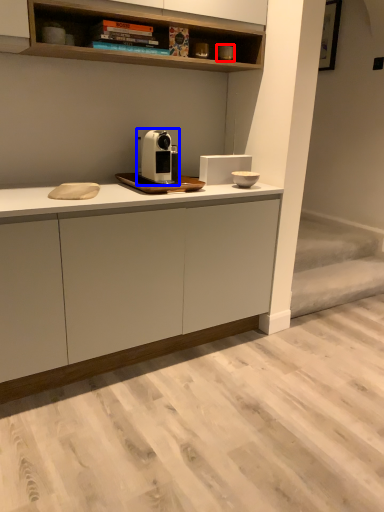
Question: Among these objects, which one is farthest to the camera, appliance (highlighted by a red box) or home appliance (highlighted by a blue box)?

Choices:
 (A) appliance
 (B) home appliance

Answer: (A)